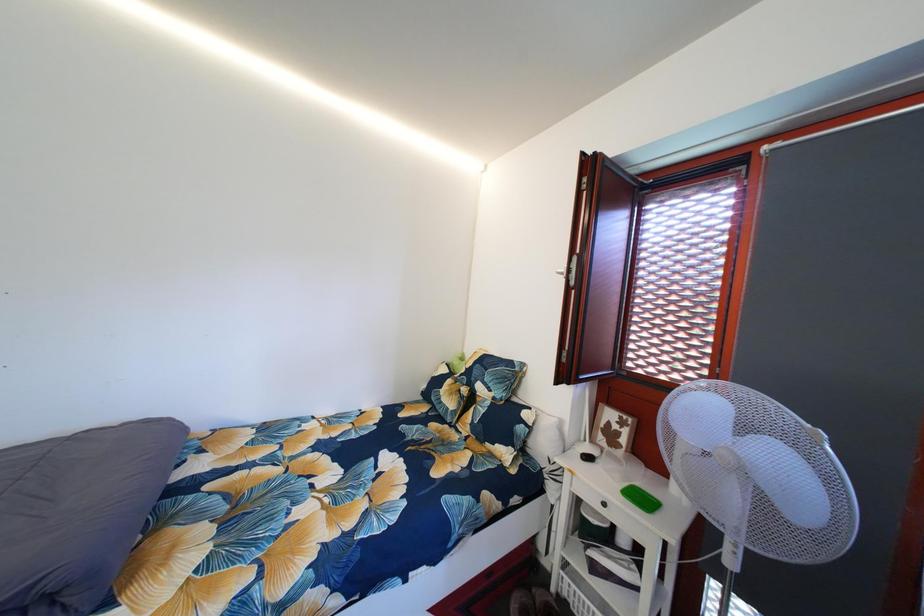
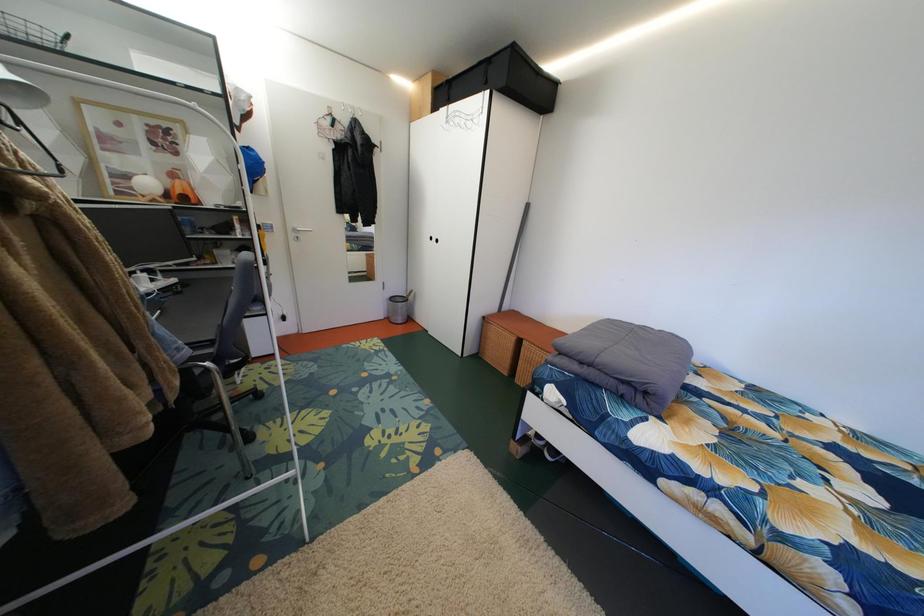
The first image is from the beginning of the video and the second image is from the end. How did the camera likely rotate when shooting the video?

The rotation direction of the camera is left-down.